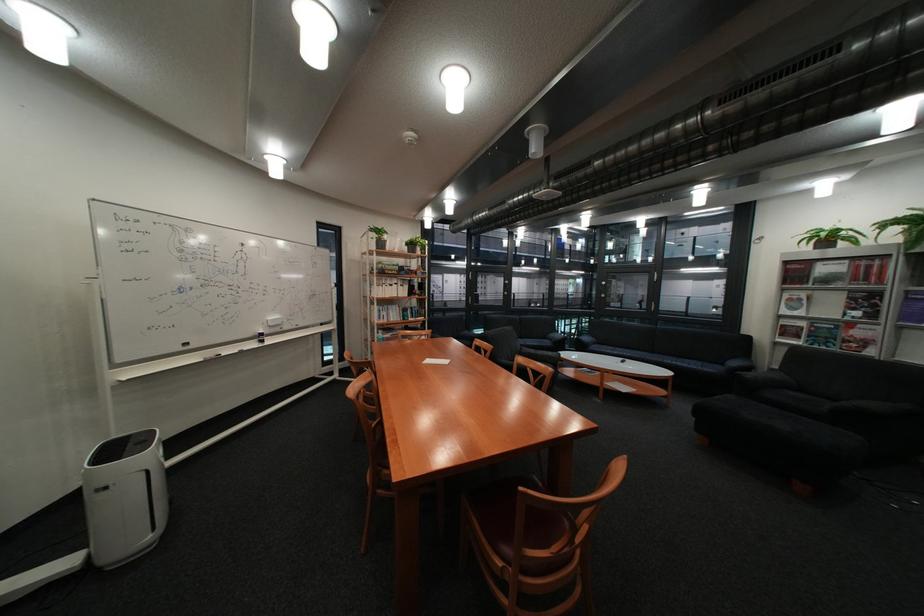
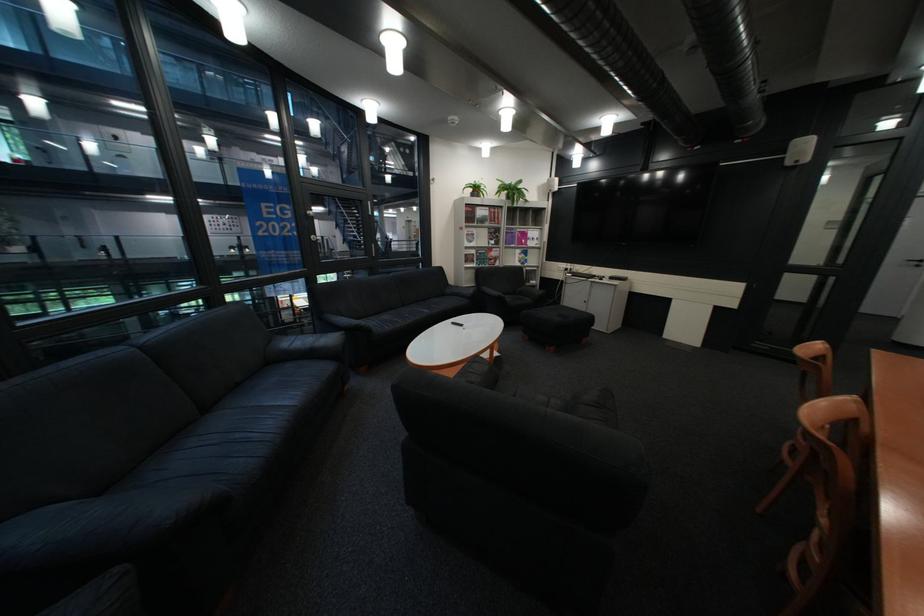
In the second image, find the point that corresponds to [833,292] in the first image.

(492, 229)